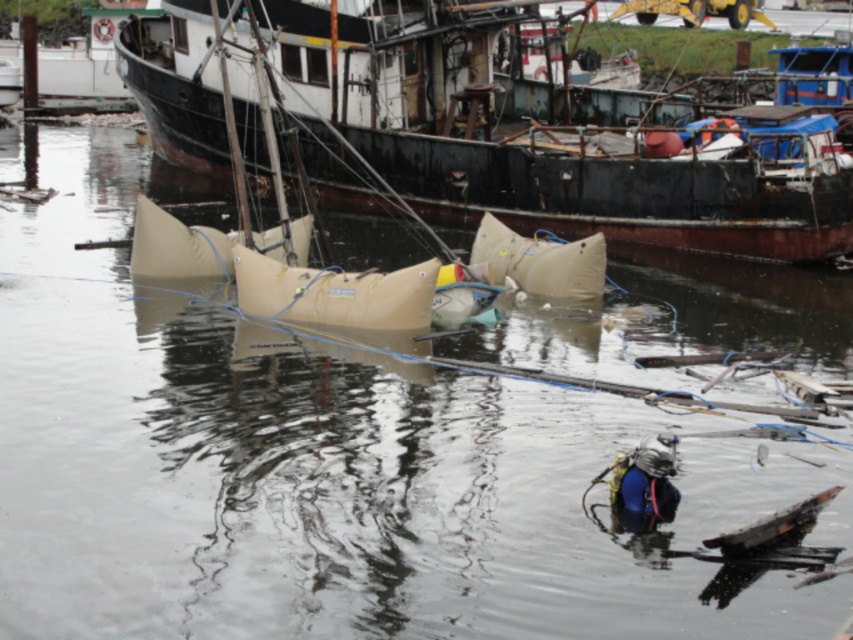
Does beige rubber boat at center appear over blue matte diving suit at lower center?

Correct, beige rubber boat at center is located above blue matte diving suit at lower center.

Is beige rubber boat at center below blue matte diving suit at lower center?

Incorrect, beige rubber boat at center is not positioned below blue matte diving suit at lower center.

What do you see at coordinates (538, 145) in the screenshot?
I see `beige rubber boat at center` at bounding box center [538, 145].

Locate an element on the screen. Image resolution: width=853 pixels, height=640 pixels. beige rubber boat at center is located at coordinates point(538,145).